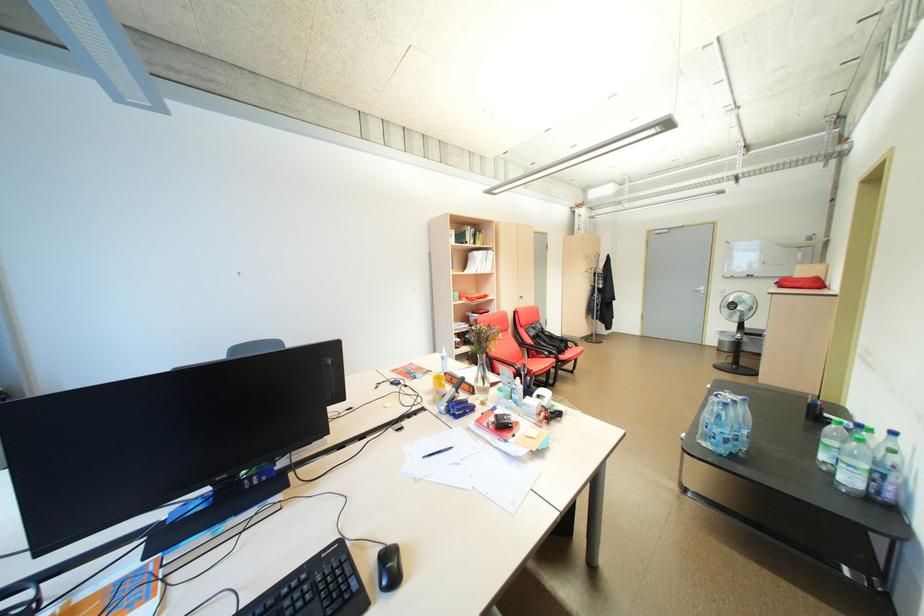
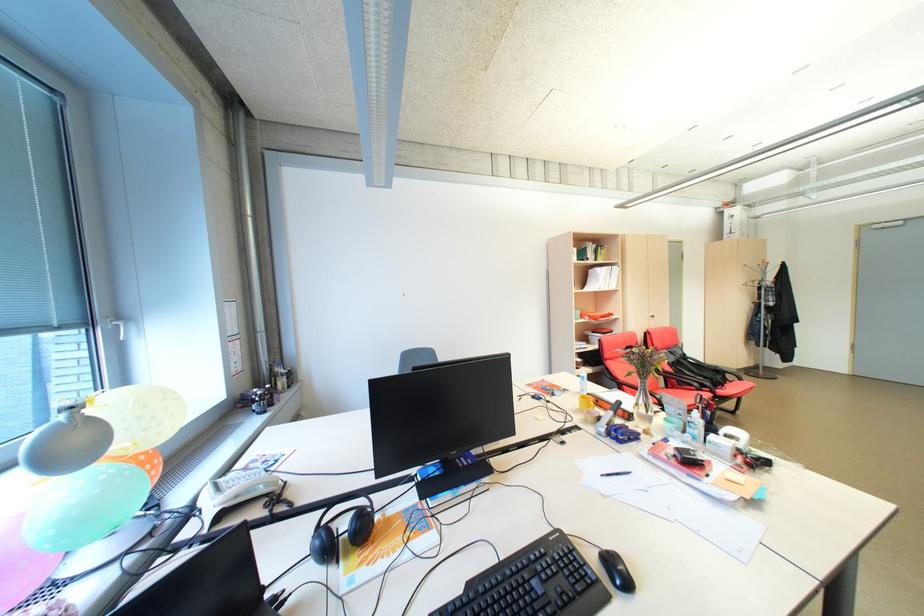
The point at (446, 398) is marked in the first image. Where is the corresponding point in the second image?

(600, 418)